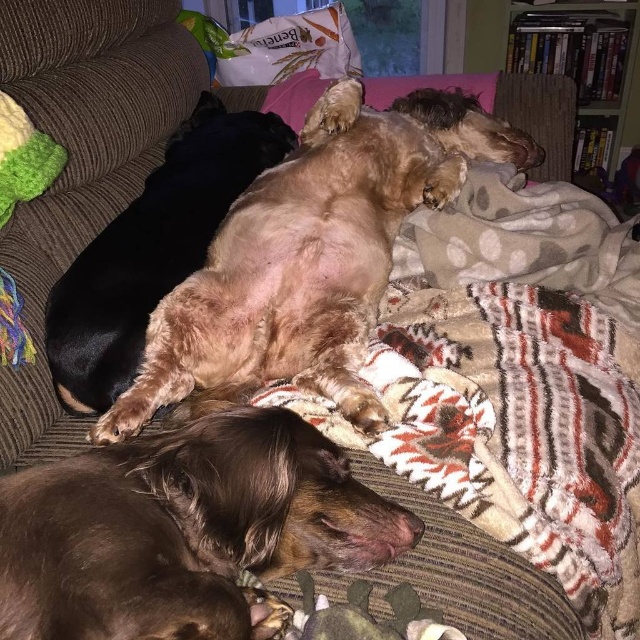
Question: Does fuzzy brown dog at center lie behind green fuzzy toy at left?

Choices:
 (A) no
 (B) yes

Answer: (B)

Question: Is brown fuzzy dog at lower left to the left of fuzzy brown dog at center from the viewer's perspective?

Choices:
 (A) yes
 (B) no

Answer: (A)

Question: Based on their relative distances, which object is farther from the brown fuzzy dog at lower left?

Choices:
 (A) green fuzzy toy at left
 (B) light brown fur at center

Answer: (A)

Question: Which of the following is the farthest from the observer?

Choices:
 (A) fuzzy brown dog at center
 (B) brown fuzzy dog at lower left
 (C) light brown fur at center

Answer: (C)

Question: Can you confirm if fuzzy brown dog at center is positioned to the left of light brown fur at center?

Choices:
 (A) no
 (B) yes

Answer: (A)

Question: Which object is closer to the camera taking this photo?

Choices:
 (A) brown fuzzy dog at lower left
 (B) light brown fur at center
 (C) green fuzzy toy at left
 (D) fuzzy brown dog at center

Answer: (A)